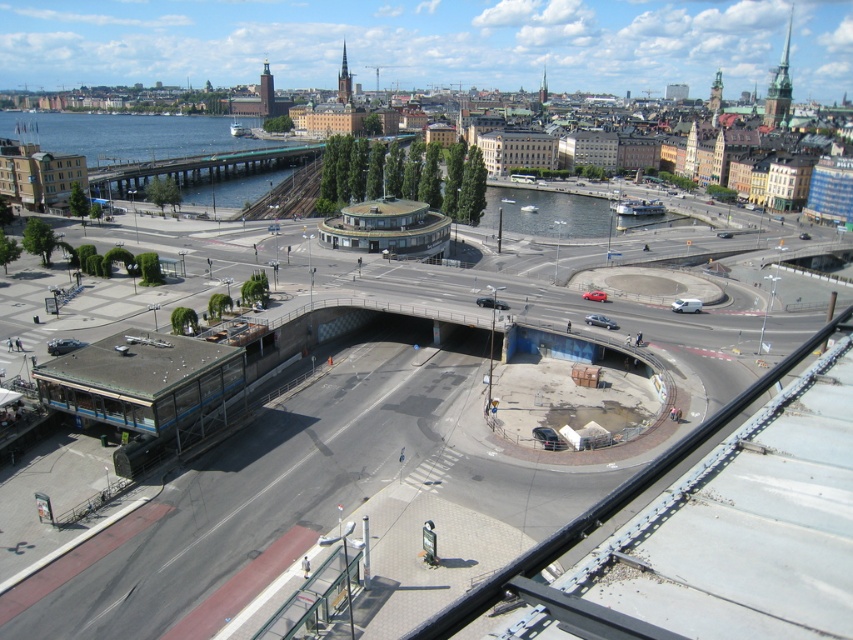
Question: Can you confirm if clear glass waterway at center is positioned to the left of silver metallic sedan at center?

Choices:
 (A) no
 (B) yes

Answer: (A)

Question: Does white matte van at center appear on the right side of silver metallic sedan at center?

Choices:
 (A) yes
 (B) no

Answer: (A)

Question: Based on their relative distances, which object is farther from the silver metallic sedan at center?

Choices:
 (A) clear glass waterway at center
 (B) blue water at left
 (C) white matte van at center

Answer: (B)

Question: Which point appears farthest from the camera in this image?

Choices:
 (A) (604, 320)
 (B) (505, 195)
 (C) (680, 305)
 (D) (97, 147)

Answer: (D)

Question: Based on their relative distances, which object is farther from the blue water at left?

Choices:
 (A) clear glass waterway at center
 (B) white matte van at center
 (C) silver metallic sedan at center

Answer: (B)

Question: Observing the image, what is the correct spatial positioning of clear glass waterway at center in reference to silver metallic sedan at center?

Choices:
 (A) left
 (B) right

Answer: (B)